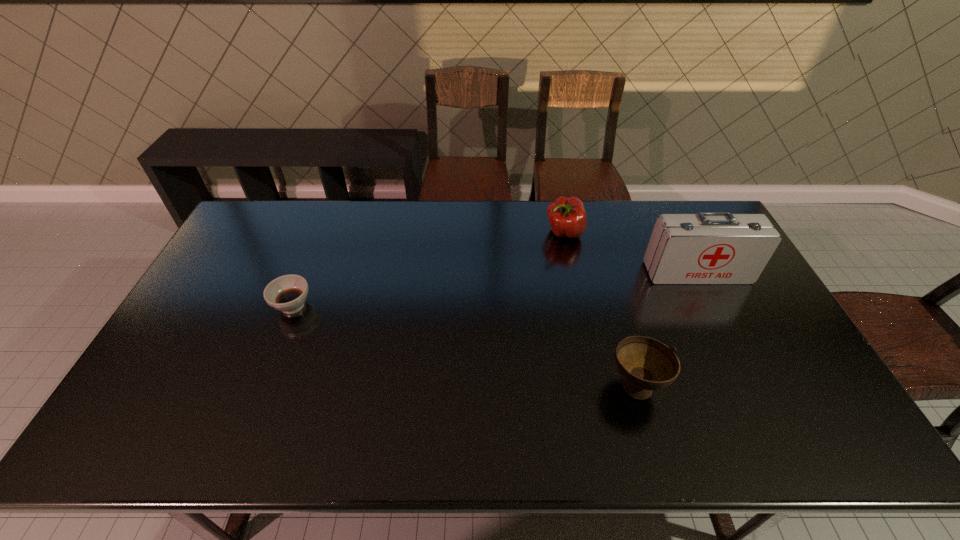
The image size is (960, 540). In order to click on vacant space located on the front of the shortest object in this screenshot , I will do `click(272, 359)`.

This screenshot has width=960, height=540. I want to click on object situated at the far edge, so pyautogui.click(x=567, y=216).

This screenshot has height=540, width=960. What are the coordinates of `object at the right edge` in the screenshot? It's located at (707, 248).

Find the location of `free space at the far edge of the desktop`. free space at the far edge of the desktop is located at coordinates (398, 234).

What are the coordinates of `vacant space at the left edge of the desktop` in the screenshot? It's located at (179, 401).

The height and width of the screenshot is (540, 960). In the image, there is a desktop. What are the coordinates of `vacant space at the far left corner` in the screenshot? It's located at (264, 227).

At what (x,y) coordinates should I click in order to perform the action: click on vacant point at the far right corner. Please return your answer as a coordinate pair (x, y). Looking at the image, I should click on (682, 208).

The image size is (960, 540). I want to click on vacant space that is in between the tallest object and the nearest object, so click(x=666, y=329).

The height and width of the screenshot is (540, 960). In order to click on free space between the first-aid kit and the leftmost object in this screenshot , I will do `click(495, 289)`.

Locate an element on the screen. free area in between the tallest object and the farthest object is located at coordinates (631, 253).